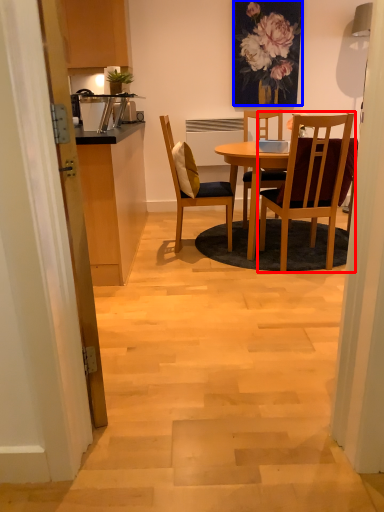
Question: Among these objects, which one is farthest to the camera, chair (highlighted by a red box) or floral arrangement (highlighted by a blue box)?

Choices:
 (A) chair
 (B) floral arrangement

Answer: (B)